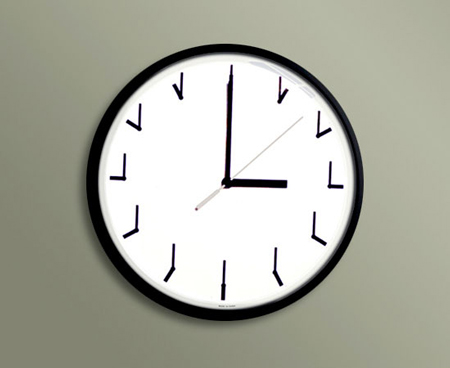
I want to click on minute hand of clock, so click(x=228, y=113).